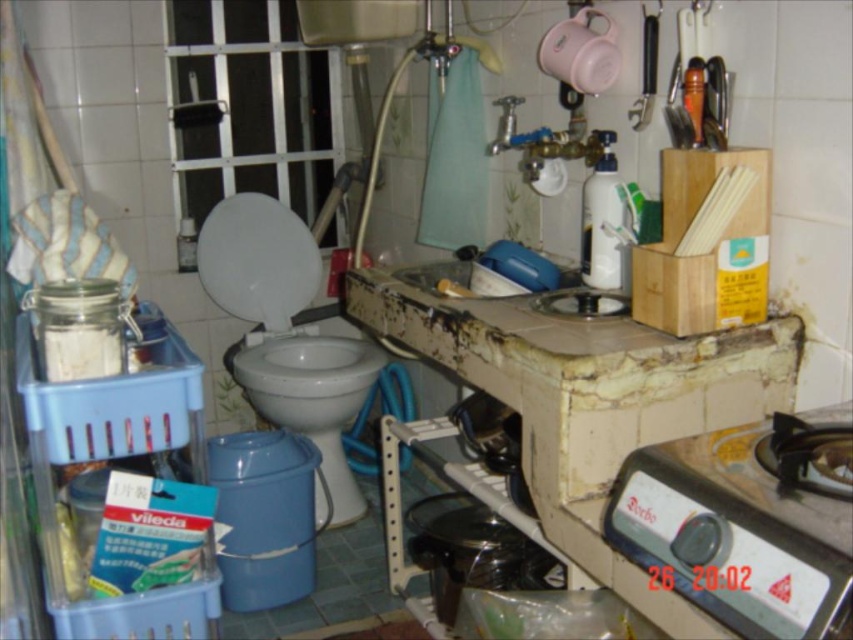
Is rusty concrete countertop at center below blue plastic sink at center?

Indeed, rusty concrete countertop at center is positioned under blue plastic sink at center.

Is rusty concrete countertop at center shorter than blue plastic sink at center?

No.

What do you see at coordinates (584, 394) in the screenshot? Image resolution: width=853 pixels, height=640 pixels. I see `rusty concrete countertop at center` at bounding box center [584, 394].

Locate an element on the screen. The image size is (853, 640). rusty concrete countertop at center is located at coordinates (584, 394).

At what (x,y) coordinates should I click in order to perform the action: click on white glossy toilet bowl at center. Please return your answer as a coordinate pair (x, y). The width and height of the screenshot is (853, 640). Looking at the image, I should click on (312, 396).

Can you confirm if white glossy toilet bowl at center is bigger than blue plastic sink at center?

Yes, white glossy toilet bowl at center is bigger than blue plastic sink at center.

At what (x,y) coordinates should I click in order to perform the action: click on white glossy toilet bowl at center. Please return your answer as a coordinate pair (x, y). This screenshot has height=640, width=853. Looking at the image, I should click on pos(312,396).

Is rusty concrete countertop at center bigger than white glossy toilet bowl at center?

Yes, rusty concrete countertop at center is bigger than white glossy toilet bowl at center.

Between rusty concrete countertop at center and white glossy toilet bowl at center, which one appears on the left side from the viewer's perspective?

white glossy toilet bowl at center

Who is more forward, [625,403] or [247,371]?

Point [625,403] is in front.

The image size is (853, 640). I want to click on rusty concrete countertop at center, so click(x=584, y=394).